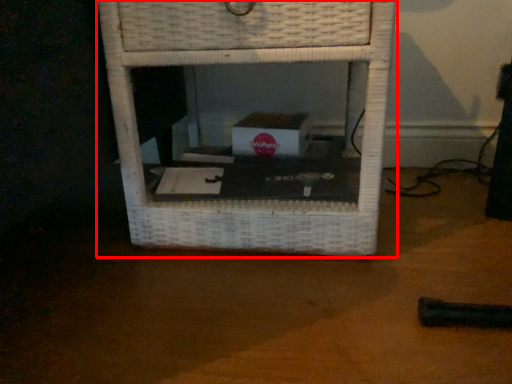
Question: In this image, where is furniture (annotated by the red box) located relative to table top?

Choices:
 (A) right
 (B) left

Answer: (A)